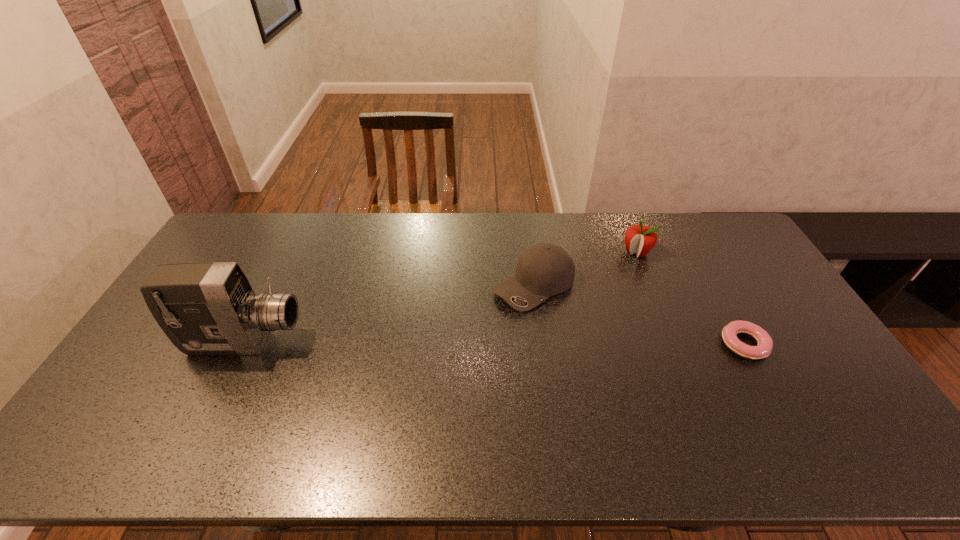
In the image, there is a desktop. Where is `vacant space at the far right corner`? vacant space at the far right corner is located at coordinates (716, 233).

Where is `empty location between the tallest object and the third object from right to left`? The height and width of the screenshot is (540, 960). empty location between the tallest object and the third object from right to left is located at coordinates (389, 314).

The height and width of the screenshot is (540, 960). In order to click on blank region between the baseball cap and the tallest object in this screenshot , I will do coord(389,314).

Image resolution: width=960 pixels, height=540 pixels. What are the coordinates of `blank region between the rightmost object and the second object from right to left` in the screenshot? It's located at (690, 299).

Identify the location of vacant point located between the baseball cap and the camcorder. The width and height of the screenshot is (960, 540). tap(389, 314).

Image resolution: width=960 pixels, height=540 pixels. I want to click on free space that is in between the tallest object and the apple, so click(441, 298).

At what (x,y) coordinates should I click in order to perform the action: click on free spot between the tallest object and the rightmost object. Please return your answer as a coordinate pair (x, y). The image size is (960, 540). Looking at the image, I should click on (494, 343).

Where is `vacant region between the tallest object and the shortest object`? This screenshot has height=540, width=960. vacant region between the tallest object and the shortest object is located at coordinates (494, 343).

Locate an element on the screen. This screenshot has width=960, height=540. unoccupied area between the camcorder and the rightmost object is located at coordinates (494, 343).

Locate an element on the screen. The height and width of the screenshot is (540, 960). free spot between the leftmost object and the rightmost object is located at coordinates (494, 343).